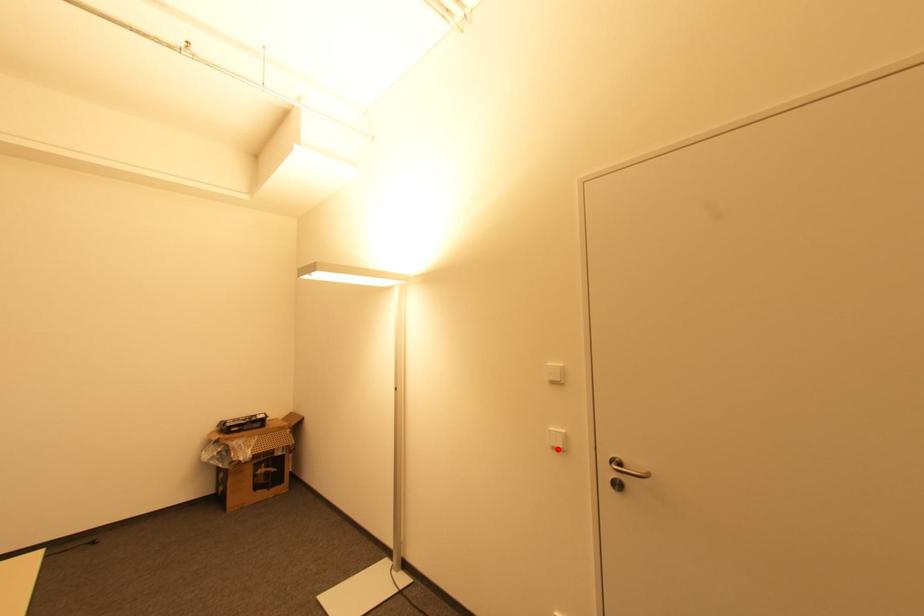
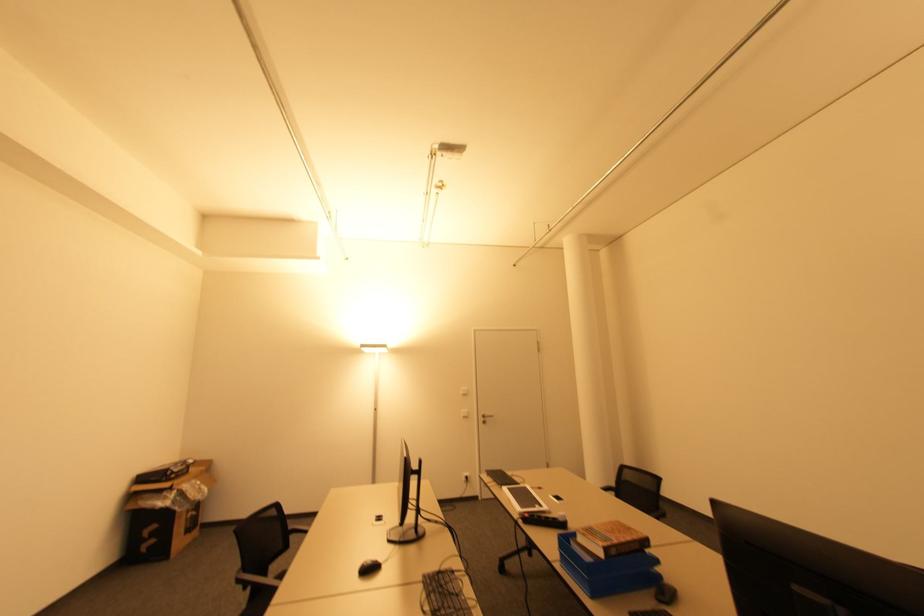
In the second image, find the point that corresponds to the highlighted location in the first image.

(467, 416)